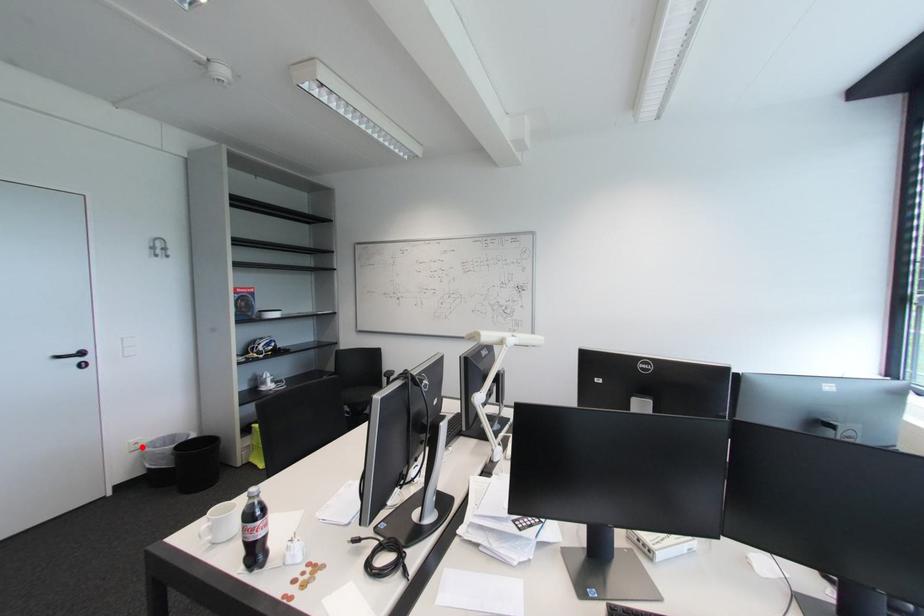
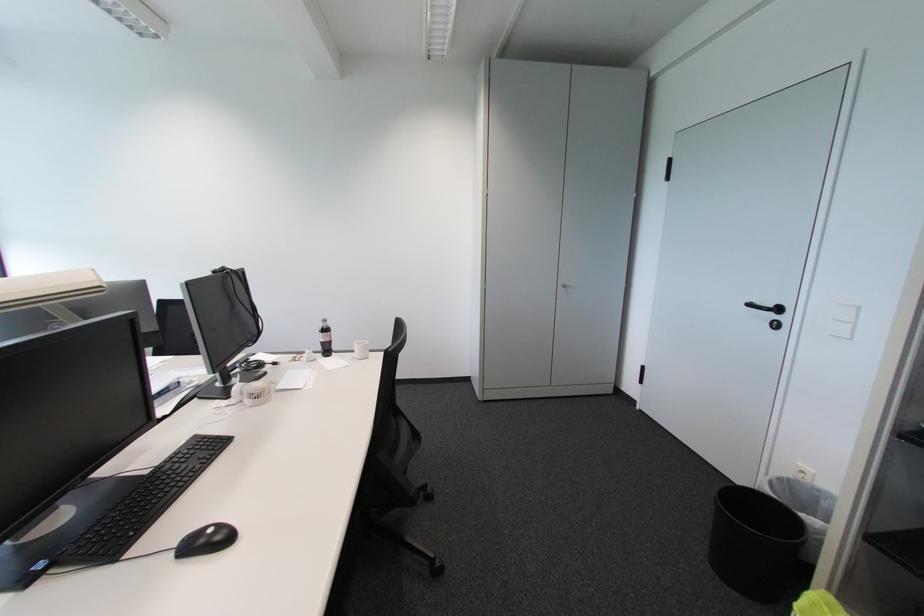
Question: I am providing you with two images of the same scene from different viewpoints. Image1 has a red point marked. In image2, the corresponding 3D location appears at what relative position? Reply with the corresponding letter.

Choices:
 (A) Closer
 (B) Farther

Answer: (B)